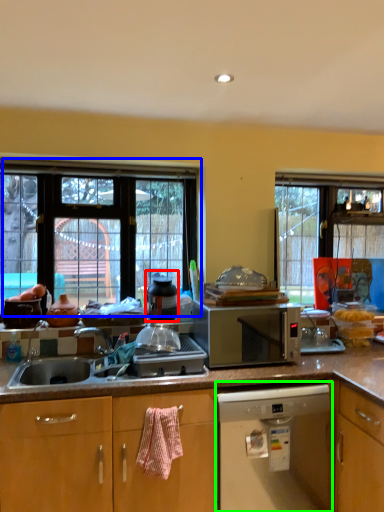
Question: Which is nearer to the appliance (highlighted by a red box)? window (highlighted by a blue box) or home appliance (highlighted by a green box).

Choices:
 (A) window
 (B) home appliance

Answer: (A)